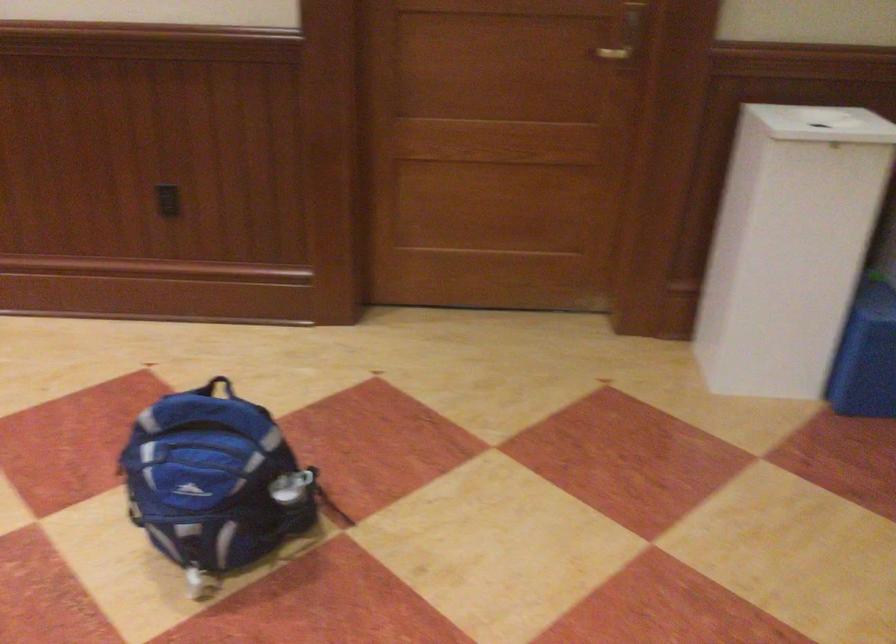
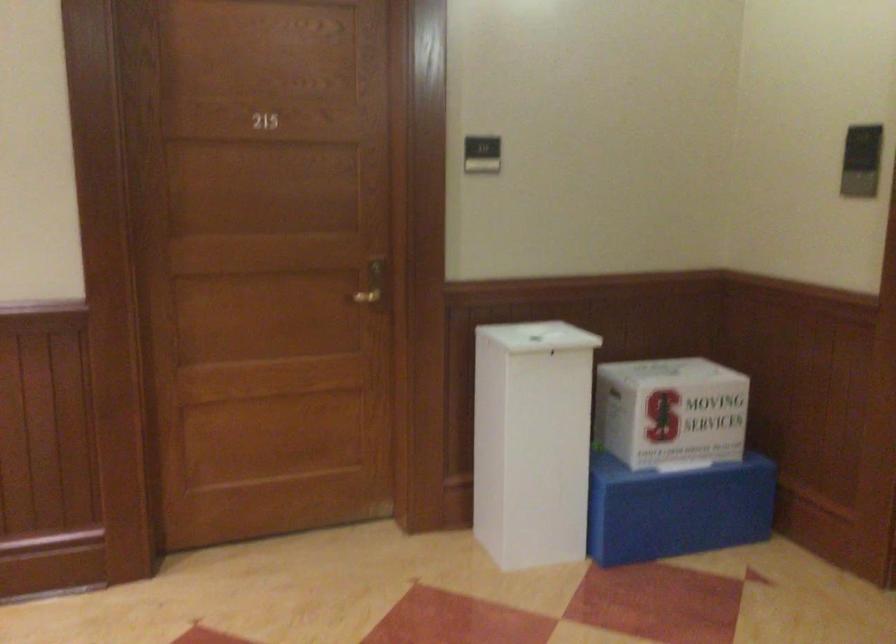
Question: The camera is either moving clockwise (left) or counter-clockwise (right) around the object. The first image is from the beginning of the video and the second image is from the end. Is the camera moving left or right when shooting the video?

Choices:
 (A) Left
 (B) Right

Answer: (A)